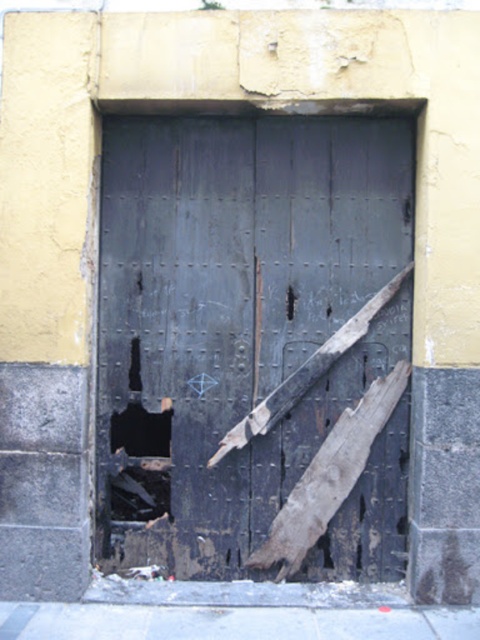
You are a delivery person trying to deliver a package to the address shown in the image. The package is too large to fit through any gaps. Can you deliver the package through the charred wood door at center or the black matte hole at center?

The charred wood door at center is larger in size than the black matte hole at center, so the package can be delivered through the charred wood door at center since it is bigger and more likely to accommodate the package.

You are a maintenance worker assessing the damage to the door and wall. You notice two holes in the wall in front of the door. The rusty metal hole at lower left and the black matte hole at center. Which hole requires immediate attention based on its size?

The rusty metal hole at lower left requires immediate attention because it is bigger than the black matte hole at center.

You are standing in front of a weathered black metal door with a blue diamond shape near the center and a charred wood door at center. Which door is positioned closer to the center of the image?

The charred wood door at center is located at point (262,336), which is closer to the center of the image compared to the weathered black metal door described in the scene.